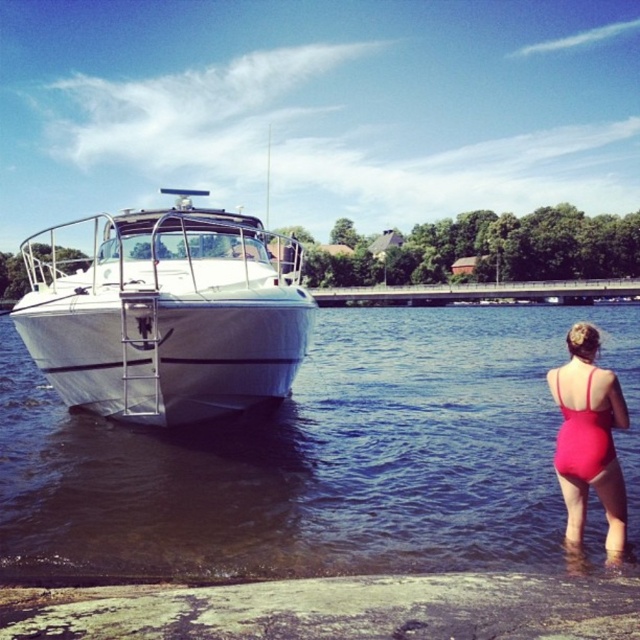
You are standing at the center of the frame and want to walk towards the white glossy boat at left and the matte red swimsuit at lower right. Which object will you reach first?

The white glossy boat at left will be reached first because it is positioned on the left side of the matte red swimsuit at lower right, making it closer to your starting position at the center.

You are a photographer trying to capture the reflection of the clear water at boat right and the matte red swimsuit at lower right. Which object will have a more distorted reflection due to its height?

The clear water at boat right has a greater height compared to the matte red swimsuit at lower right, so its reflection will be more distorted because taller objects tend to have more distortion in reflections.

Based on the photo, you are a photographer positioned at the front of the white motorboat. You want to capture a photo of the matte red swimsuit at lower right while ensuring the clear water at boat right is visible in the frame. Which direction should you aim your camera to include both objects?

To include both the clear water at boat right and the matte red swimsuit at lower right, you should aim your camera to the left, as the clear water at boat right is positioned to the left of the matte red swimsuit at lower right.